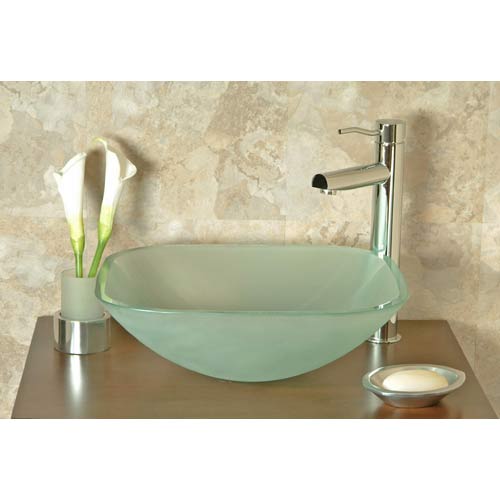
Locate an element on the screen. The width and height of the screenshot is (500, 500). soap bar is located at coordinates (414, 378).